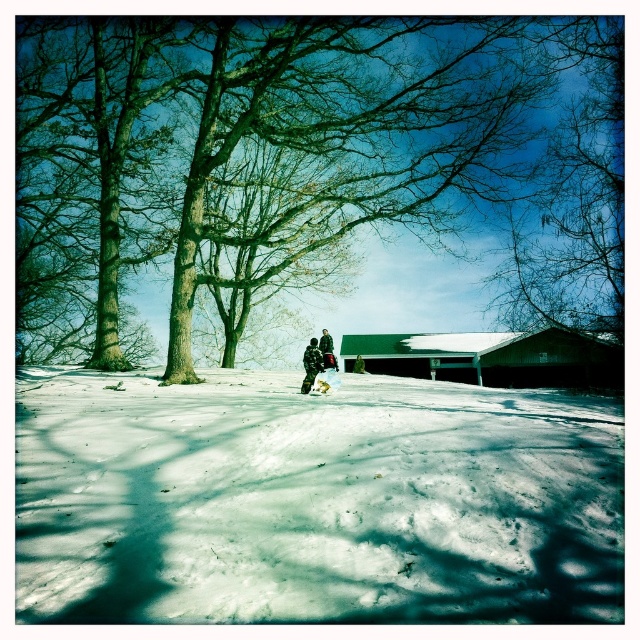
You are an observer standing in the winter scene and notice the white powdery snow at center and the snowy camouflage jacket at center. Which object is located more to the left?

The white powdery snow at center is positioned on the left side of the snowy camouflage jacket at center, so it is more to the left.